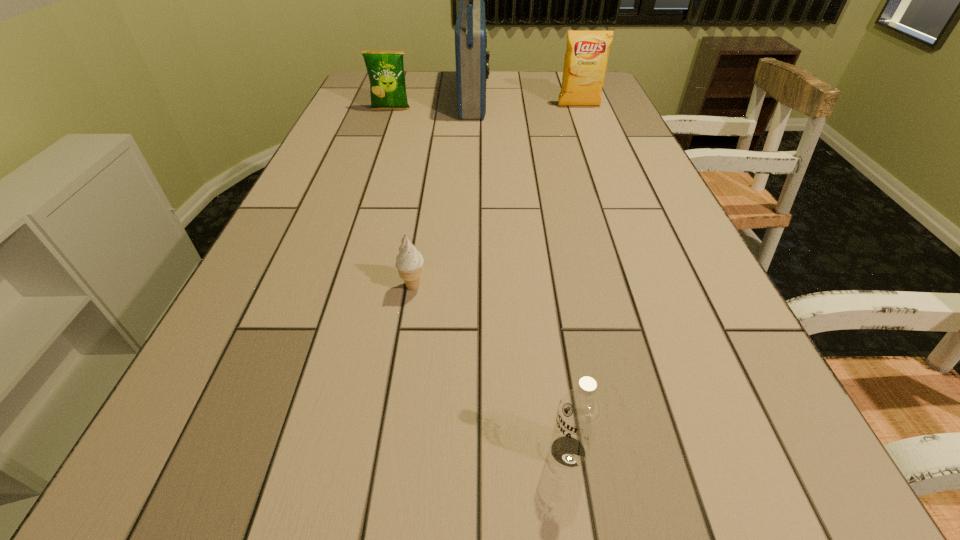
This screenshot has height=540, width=960. Find the location of `vacant region at the far edge of the desktop`. vacant region at the far edge of the desktop is located at coordinates (540, 83).

At what (x,y) coordinates should I click in order to perform the action: click on blank space at the left edge of the desktop. Please return your answer as a coordinate pair (x, y). Image resolution: width=960 pixels, height=540 pixels. Looking at the image, I should click on (300, 294).

Identify the location of vacant space at the right edge. The image size is (960, 540). (635, 131).

Find the location of `free area in between the third object from right to left and the left crisp (potato chip)`. free area in between the third object from right to left and the left crisp (potato chip) is located at coordinates (433, 104).

The width and height of the screenshot is (960, 540). What are the coordinates of `free space between the second object from right to left and the right crisp (potato chip)` in the screenshot? It's located at point(573,279).

Find the location of a particular element. This screenshot has height=540, width=960. free point between the nearest object and the taller crisp (potato chip) is located at coordinates (573, 279).

At what (x,y) coordinates should I click in order to perform the action: click on free spot between the leftmost object and the shortest object. Please return your answer as a coordinate pair (x, y). The height and width of the screenshot is (540, 960). Looking at the image, I should click on tap(402, 198).

Identify the location of free space between the fourth object from left to right and the fourth shortest object. (573, 279).

Identify the location of free spot between the shorter crisp (potato chip) and the radio receiver. (433, 104).

Locate an element on the screen. This screenshot has height=540, width=960. free point between the nearest object and the icecream is located at coordinates (491, 369).